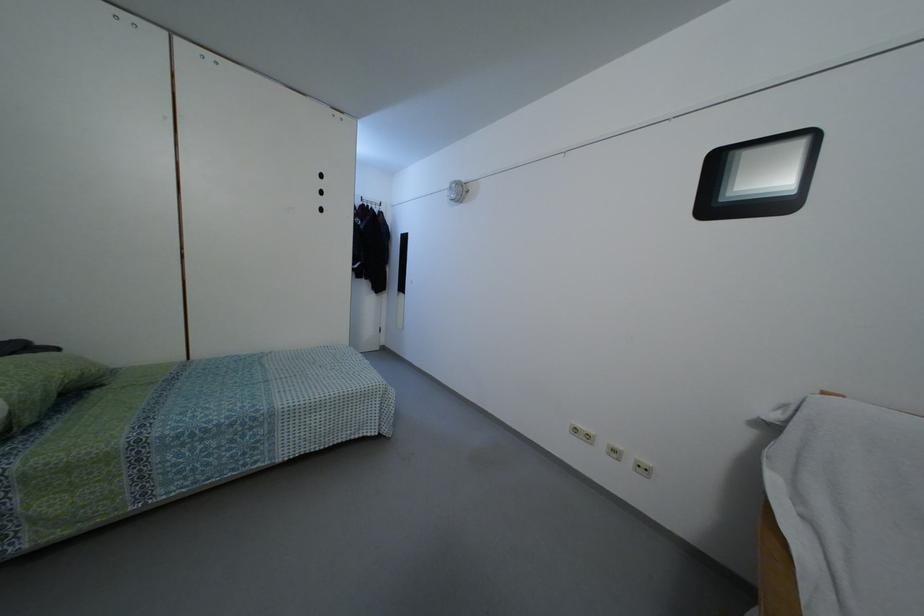
Where would you lift the green patterned pillow? Please return your answer as a coordinate pair (x, y).

(42, 382)